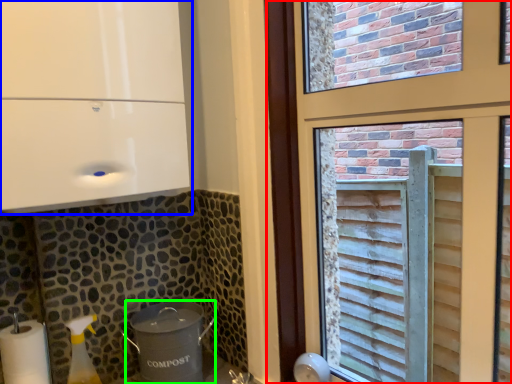
Question: Which object is positioned farthest from window (highlighted by a red box)? Select from appliance (highlighted by a blue box) and appliance (highlighted by a green box).

Choices:
 (A) appliance
 (B) appliance

Answer: (B)